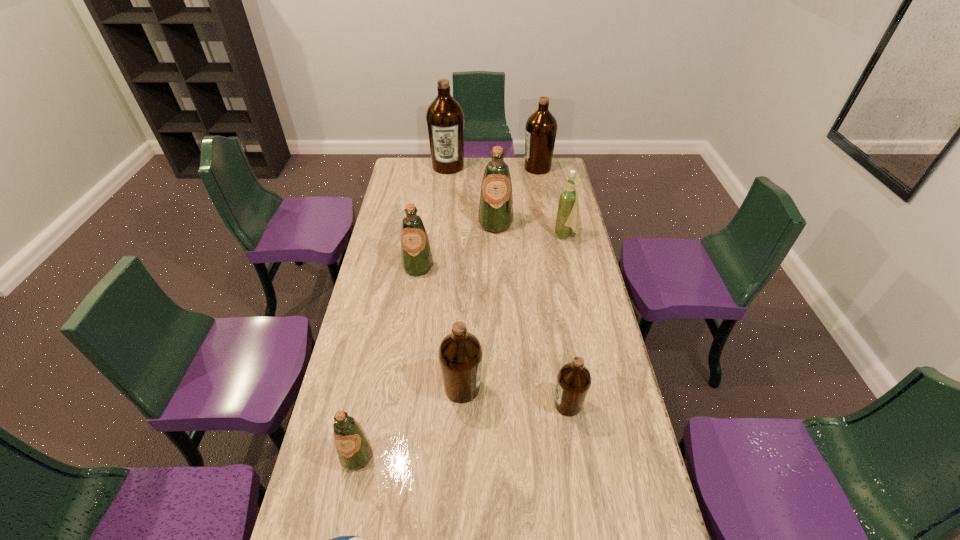
The height and width of the screenshot is (540, 960). I want to click on vacant space at the right edge, so click(644, 491).

Locate an element on the screen. The height and width of the screenshot is (540, 960). vacant region at the far left corner is located at coordinates (399, 159).

Locate an element on the screen. free area in between the smallest green olive oil and the second biggest brown olive oil is located at coordinates (447, 312).

Find the location of `free space between the smallest brown olive oil and the wine bottle`. free space between the smallest brown olive oil and the wine bottle is located at coordinates (566, 320).

Locate an element on the screen. The height and width of the screenshot is (540, 960). vacant space that is in between the smallest brown olive oil and the second smallest brown olive oil is located at coordinates 516,396.

The height and width of the screenshot is (540, 960). In order to click on unoccupied area between the second biggest brown olive oil and the fifth nearest object in this screenshot , I will do `click(478, 218)`.

Find the location of a particular element. This screenshot has width=960, height=540. free spot between the smallest brown olive oil and the biggest green olive oil is located at coordinates coord(532,314).

Locate an element on the screen. This screenshot has width=960, height=540. vacant area that lies between the second biggest green olive oil and the smallest brown olive oil is located at coordinates click(x=493, y=336).

Locate an element on the screen. Image resolution: width=960 pixels, height=540 pixels. free space that is in between the biggest brown olive oil and the smallest brown olive oil is located at coordinates (508, 285).

This screenshot has height=540, width=960. Find the location of `free spot between the second biggest green olive oil and the tallest olive oil`. free spot between the second biggest green olive oil and the tallest olive oil is located at coordinates (433, 217).